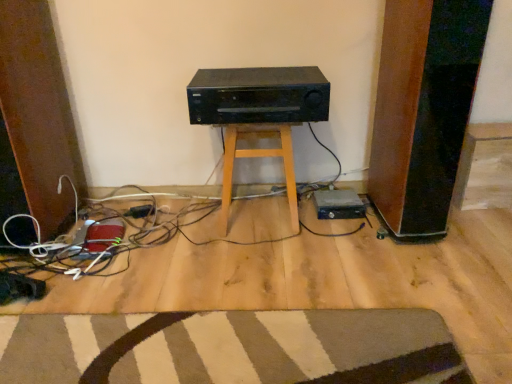
Find the location of `free space between wooden stool at center and black plastic plug at lower center`. free space between wooden stool at center and black plastic plug at lower center is located at coordinates (184, 217).